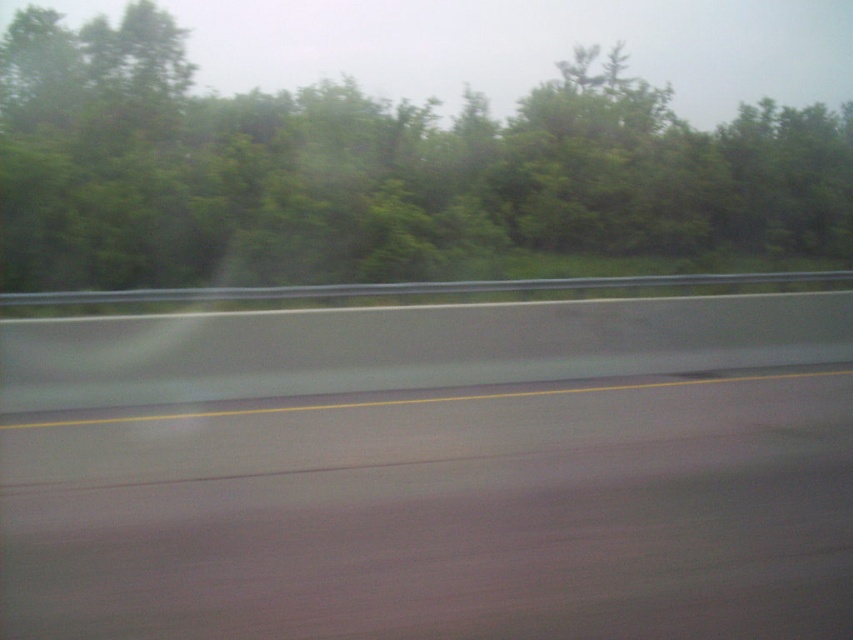
Question: Can you confirm if smooth asphalt highway at center is positioned to the left of green leafy tree at upper center?

Choices:
 (A) yes
 (B) no

Answer: (A)

Question: Among these points, which one is farthest from the camera?

Choices:
 (A) (x=146, y=225)
 (B) (x=167, y=573)

Answer: (A)

Question: Can you confirm if smooth asphalt highway at center is smaller than green leafy tree at upper center?

Choices:
 (A) no
 (B) yes

Answer: (B)

Question: Can you confirm if smooth asphalt highway at center is positioned to the left of green leafy tree at upper center?

Choices:
 (A) yes
 (B) no

Answer: (A)